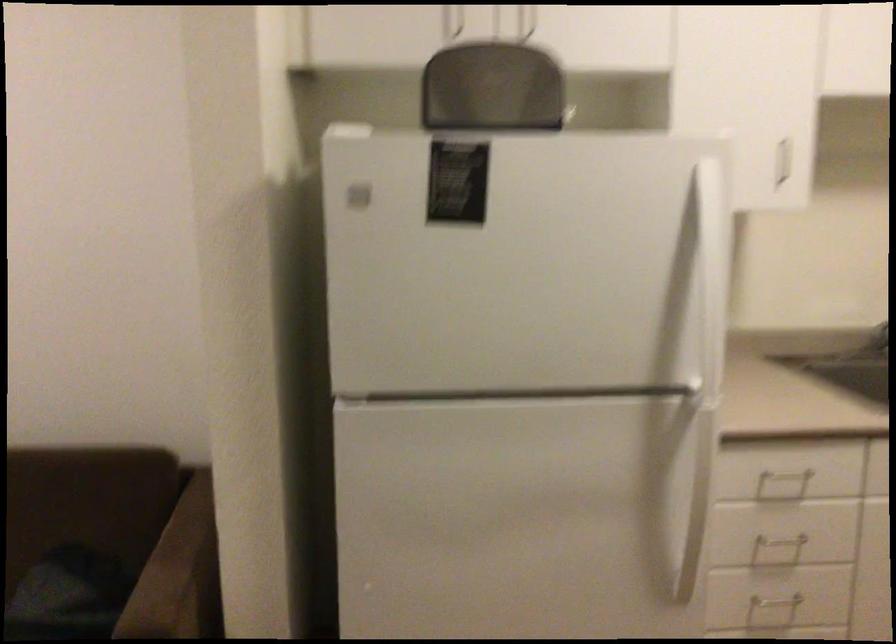
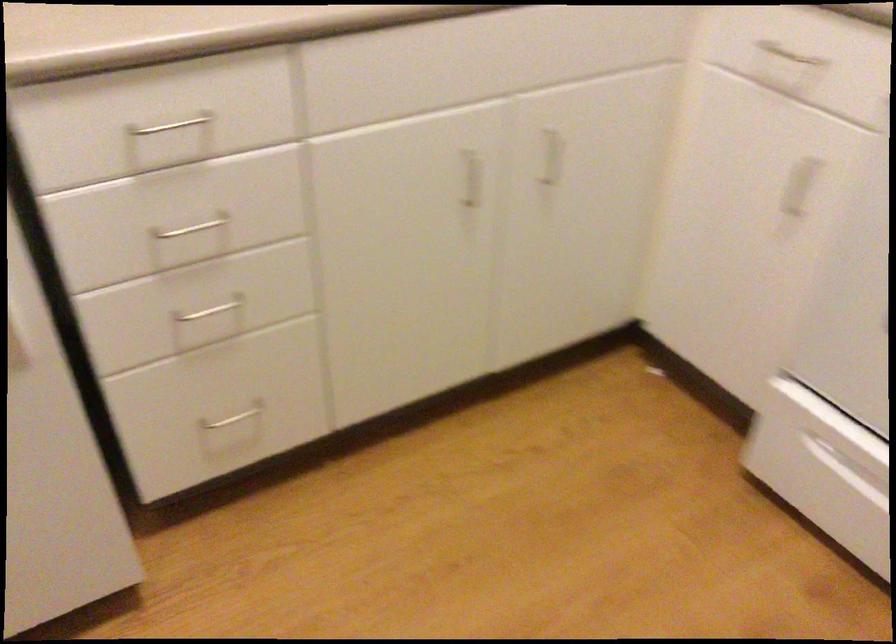
In the second image, find the point that corresponds to (778,542) in the first image.

(192, 228)